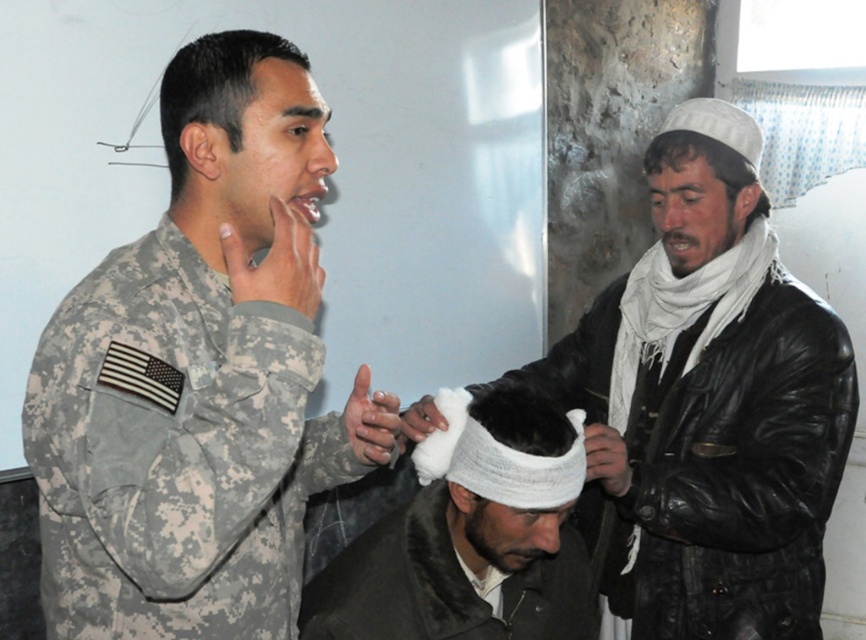
Does white bandaged head at center appear on the right side of white soft scarf at upper right?

In fact, white bandaged head at center is to the left of white soft scarf at upper right.

Is white bandaged head at center thinner than white soft scarf at upper right?

No.

Is point (501, 408) positioned behind point (677, 209)?

No, (501, 408) is closer to viewer.

Locate an element on the screen. white bandaged head at center is located at coordinates (470, 541).

Is camouflage uniform at left shorter than matte skin forehead at center?

No, camouflage uniform at left is not shorter than matte skin forehead at center.

Is camouflage uniform at left to the right of matte skin forehead at center from the viewer's perspective?

In fact, camouflage uniform at left is to the left of matte skin forehead at center.

What are the coordinates of `camouflage uniform at left` in the screenshot? It's located at (241, 134).

Is point (703, 120) behind point (488, 580)?

Yes, it is behind point (488, 580).

Between white matte headband at center and white bandaged head at center, which one appears on the left side from the viewer's perspective?

Positioned to the left is white bandaged head at center.

Is point (727, 268) positioned behind point (565, 586)?

Yes.

You are a GUI agent. You are given a task and a screenshot of the screen. Output one action in this format:
    pyautogui.click(x=<x>, y=<y>)
    Task: Click on the white matte headband at center
    The width and height of the screenshot is (866, 640).
    Given the screenshot: What is the action you would take?
    pyautogui.click(x=708, y=424)